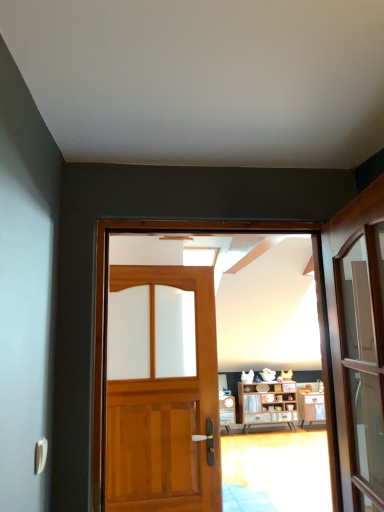
Question: Is wooden door at center, the first door in the front-to-back sequence, located outside white glossy door handle at lower left?

Choices:
 (A) no
 (B) yes

Answer: (B)

Question: From the image's perspective, is wooden door at center, positioned as the second door in back-to-front order, located above white glossy door handle at lower left?

Choices:
 (A) yes
 (B) no

Answer: (A)

Question: From the image's perspective, does wooden door at center, positioned as the second door in back-to-front order, appear lower than white glossy door handle at lower left?

Choices:
 (A) yes
 (B) no

Answer: (B)

Question: Can white glossy door handle at lower left be found inside wooden door at center, the first door in the front-to-back sequence?

Choices:
 (A) no
 (B) yes

Answer: (A)

Question: From a real-world perspective, is wooden door at center, the first door in the front-to-back sequence, on white glossy door handle at lower left?

Choices:
 (A) yes
 (B) no

Answer: (A)

Question: Based on their positions, is white glossy door handle at lower left located to the left or right of wooden door at center, which is the second door from front to back?

Choices:
 (A) right
 (B) left

Answer: (B)

Question: Considering the positions of white glossy door handle at lower left and wooden door at center, which is counted as the 1th door, starting from the back, in the image, is white glossy door handle at lower left wider or thinner than wooden door at center, which is counted as the 1th door, starting from the back,?

Choices:
 (A) thin
 (B) wide

Answer: (A)

Question: From the image's perspective, relative to wooden door at center, which is counted as the 1th door, starting from the back, is white glossy door handle at lower left above or below?

Choices:
 (A) below
 (B) above

Answer: (B)

Question: Relative to wooden door at center, which is counted as the 1th door, starting from the back, is white glossy door handle at lower left in front or behind?

Choices:
 (A) front
 (B) behind

Answer: (A)

Question: From a real-world perspective, is wooden door at center, positioned as the second door in back-to-front order, physically located above or below wooden cabinet at center?

Choices:
 (A) above
 (B) below

Answer: (A)

Question: Is wooden door at center, positioned as the second door in back-to-front order, in front of or behind wooden cabinet at center in the image?

Choices:
 (A) behind
 (B) front

Answer: (B)

Question: In terms of size, does wooden door at center, the first door in the front-to-back sequence, appear bigger or smaller than wooden cabinet at center?

Choices:
 (A) small
 (B) big

Answer: (A)

Question: Does point (317, 399) appear closer or farther from the camera than point (243, 396)?

Choices:
 (A) farther
 (B) closer

Answer: (B)

Question: Looking at their shapes, would you say wooden door at center, the first door in the front-to-back sequence, is wider or thinner than white glossy door handle at lower left?

Choices:
 (A) thin
 (B) wide

Answer: (B)

Question: Do you think wooden door at center, positioned as the second door in back-to-front order, is within white glossy door handle at lower left, or outside of it?

Choices:
 (A) outside
 (B) inside

Answer: (A)